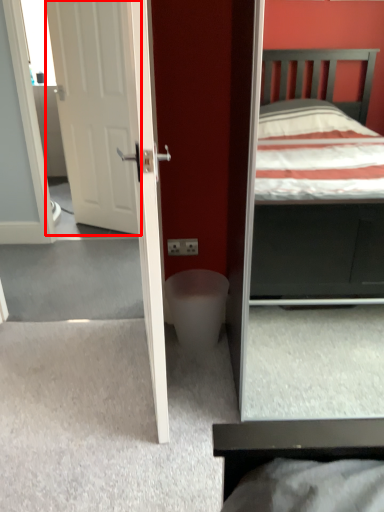
Question: From the image's perspective, where is door (annotated by the red box) located in relation to toilet bowl in the image?

Choices:
 (A) below
 (B) above

Answer: (B)